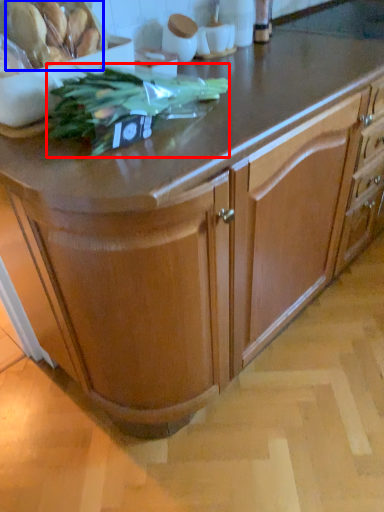
Question: Which of the following is the farthest to the observer, plant (highlighted by a red box) or food (highlighted by a blue box)?

Choices:
 (A) plant
 (B) food

Answer: (B)